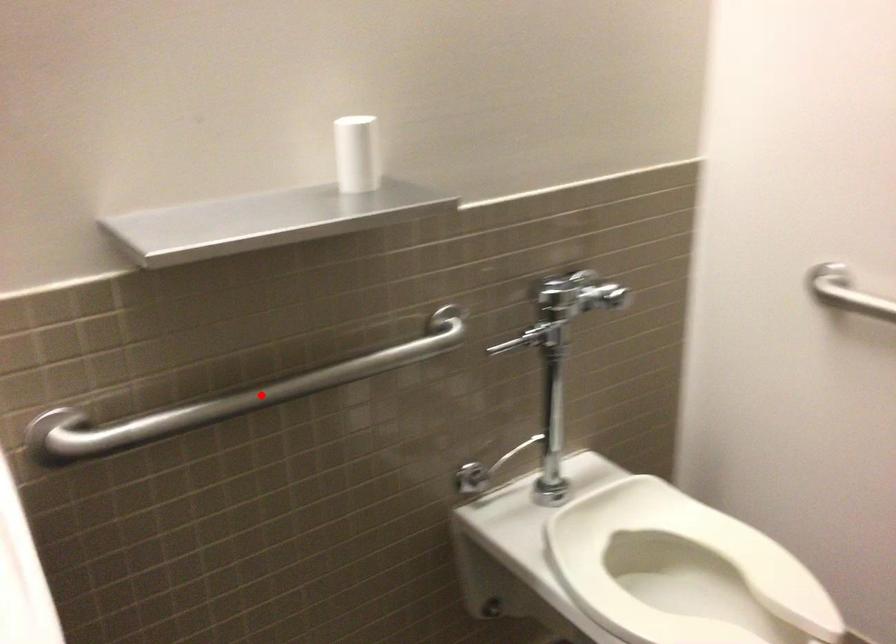
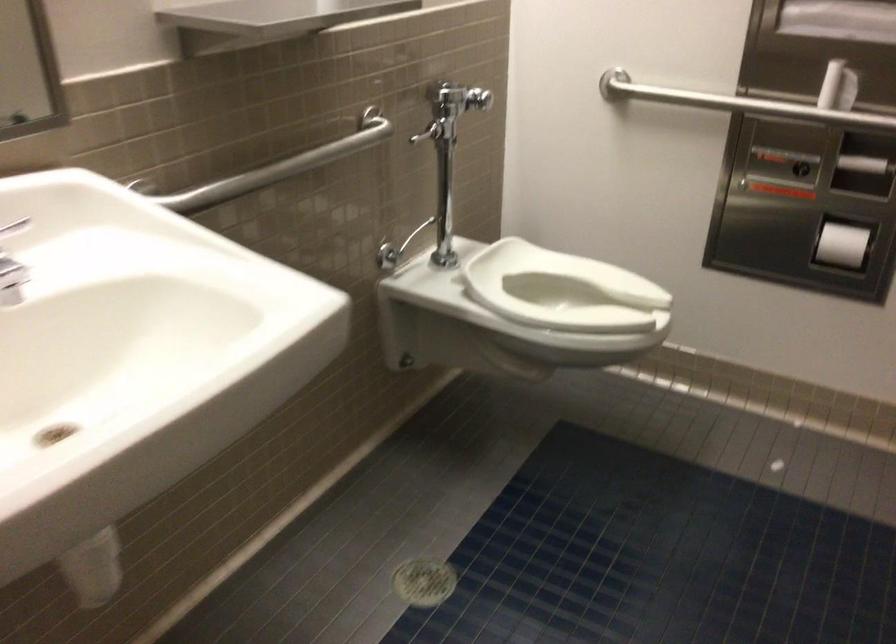
Locate, in the second image, the point that corresponds to the highlighted location in the first image.

(277, 167)